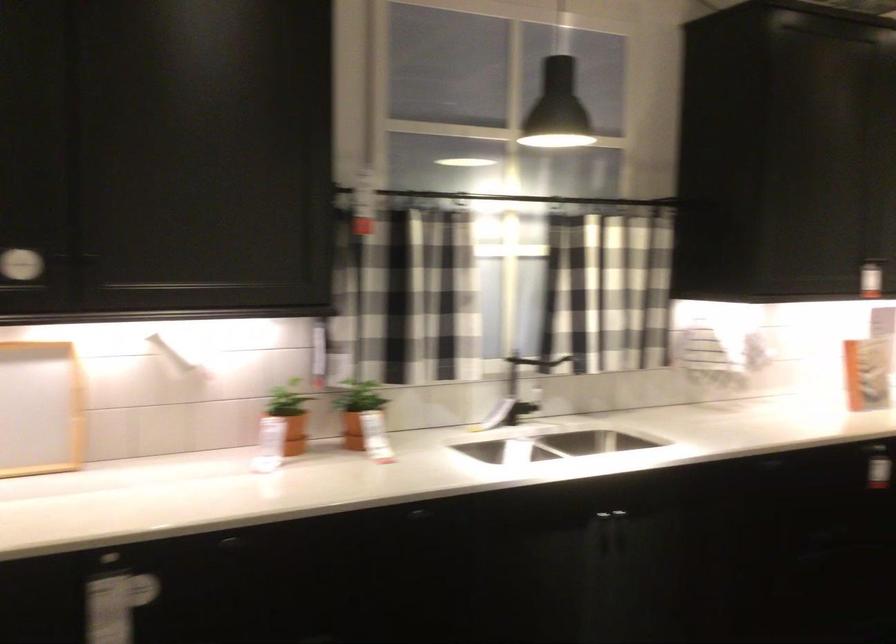
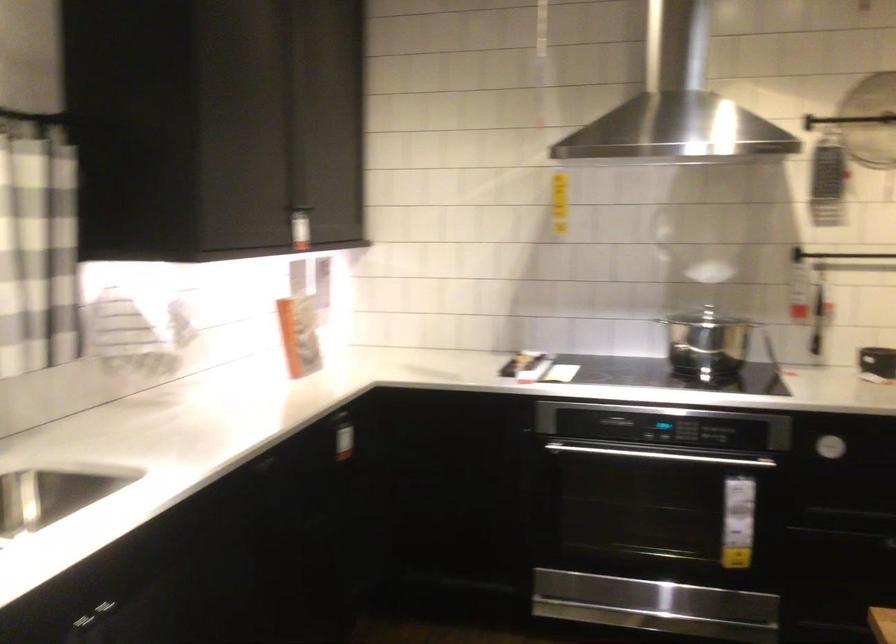
Question: Based on the continuous images, in which direction is the camera rotating? Reply with the corresponding letter.

Choices:
 (A) Left
 (B) Right
 (C) Up
 (D) Down

Answer: (B)